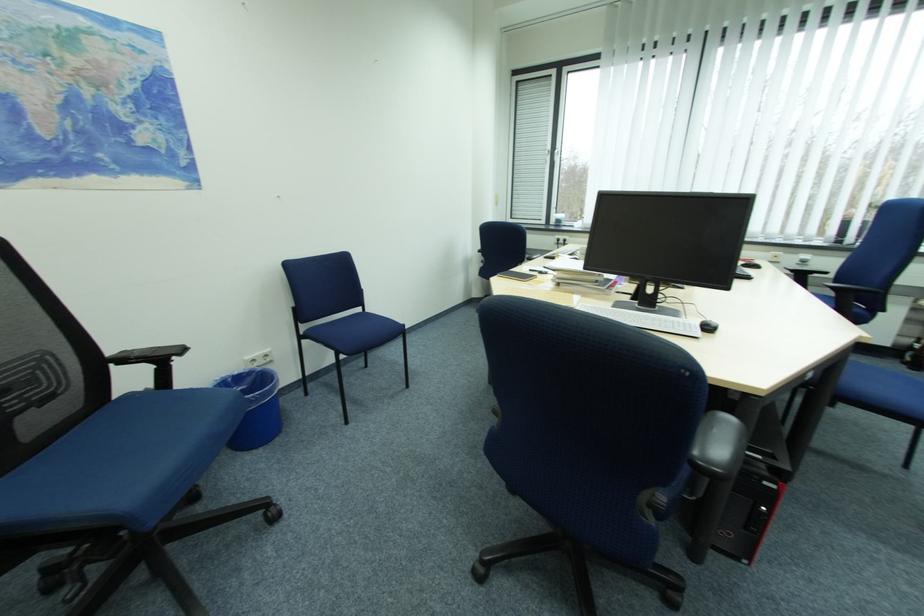
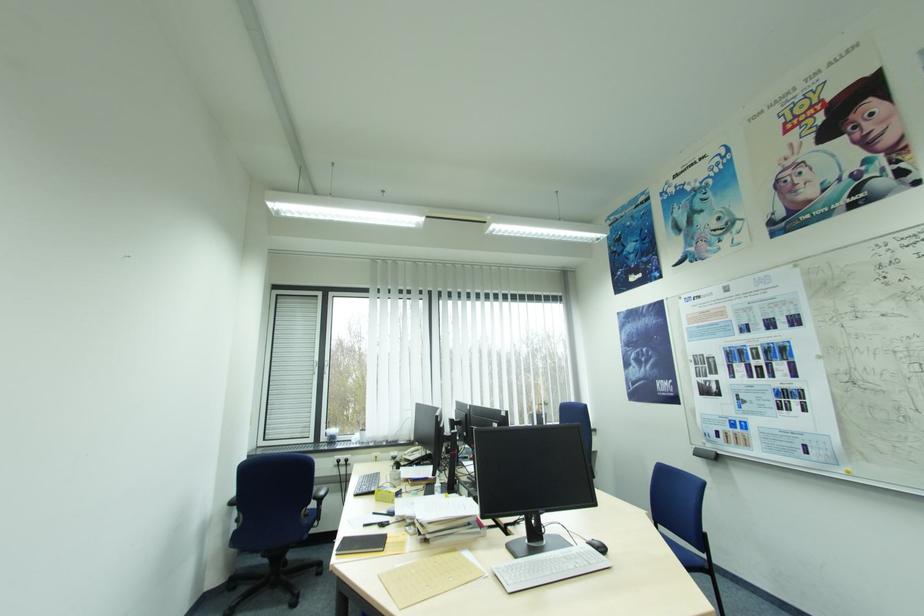
Based on the continuous images, in which direction is the camera rotating?

The camera rotated toward right-up.